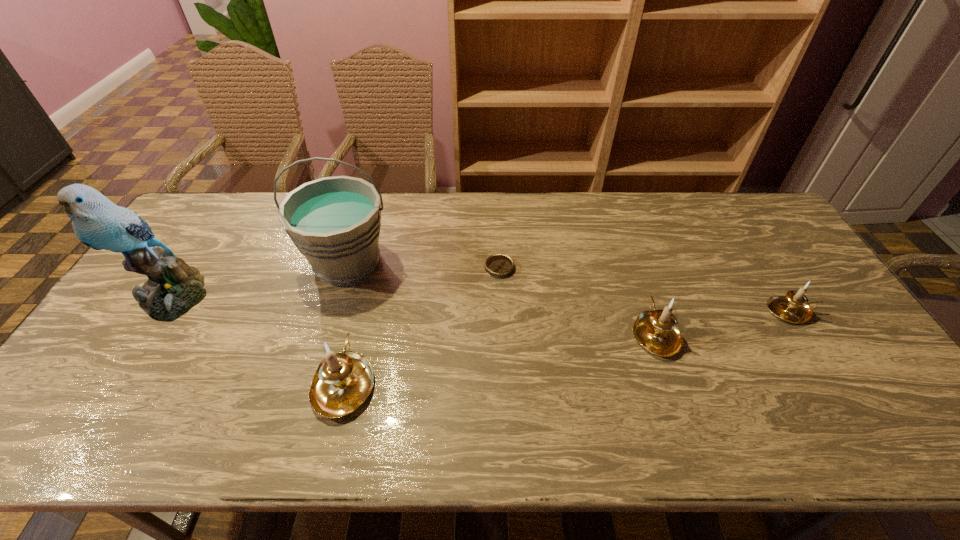
If equal spacing is desired by inserting an extra candle_holder among them, please point out a free spot for this new candle_holder. Please provide its 2D coordinates. Your answer should be formatted as a tuple, i.e. [(x, y)], where the tuple contains the x and y coordinates of a point satisfying the conditions above.

[(507, 356)]